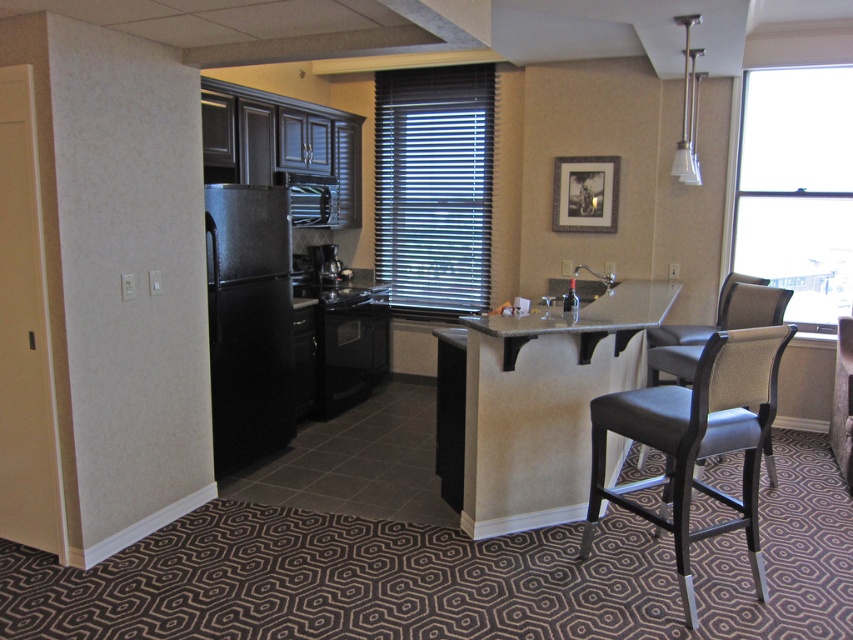
Does silver metallic blinds at center appear under satin black coffee machine at center?

Actually, silver metallic blinds at center is above satin black coffee machine at center.

Which is more to the right, silver metallic blinds at center or satin black coffee machine at center?

silver metallic blinds at center is more to the right.

Between point (386, 92) and point (347, 273), which one is positioned behind?

The point (347, 273) is more distant.

At what (x,y) coordinates should I click in order to perform the action: click on silver metallic blinds at center. Please return your answer as a coordinate pair (x, y). The width and height of the screenshot is (853, 640). Looking at the image, I should click on (434, 186).

How much distance is there between granite/textured counter top at center and dark gray fabric chair at right?

granite/textured counter top at center and dark gray fabric chair at right are 18.18 inches apart.

Identify the location of granite/textured counter top at center. (585, 320).

Is point (631, 280) closer to viewer compared to point (769, 465)?

That is False.

The image size is (853, 640). Identify the location of granite/textured counter top at center. (585, 320).

Is granite countertop at center positioned before black leather bar stool at center?

No, it is behind black leather bar stool at center.

Based on the photo, is granite countertop at center bigger than black leather bar stool at center?

Yes.

Measure the distance between granite countertop at center and camera.

granite countertop at center and camera are 9.75 feet apart from each other.

This screenshot has height=640, width=853. In order to click on granite countertop at center in this screenshot , I will do `click(532, 403)`.